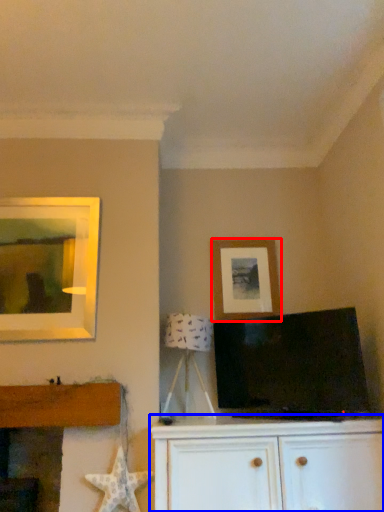
Question: Which point is closer to the camera, picture frame (highlighted by a red box) or cabinetry (highlighted by a blue box)?

Choices:
 (A) picture frame
 (B) cabinetry

Answer: (B)